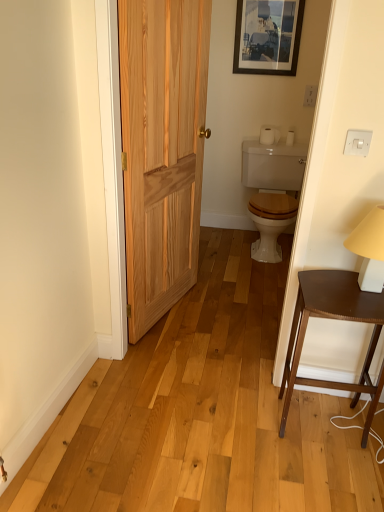
Identify the location of vacant area that is in front of white matte toilet paper at upper center, which is the 1th toilet paper in left-to-right order. (x=277, y=145).